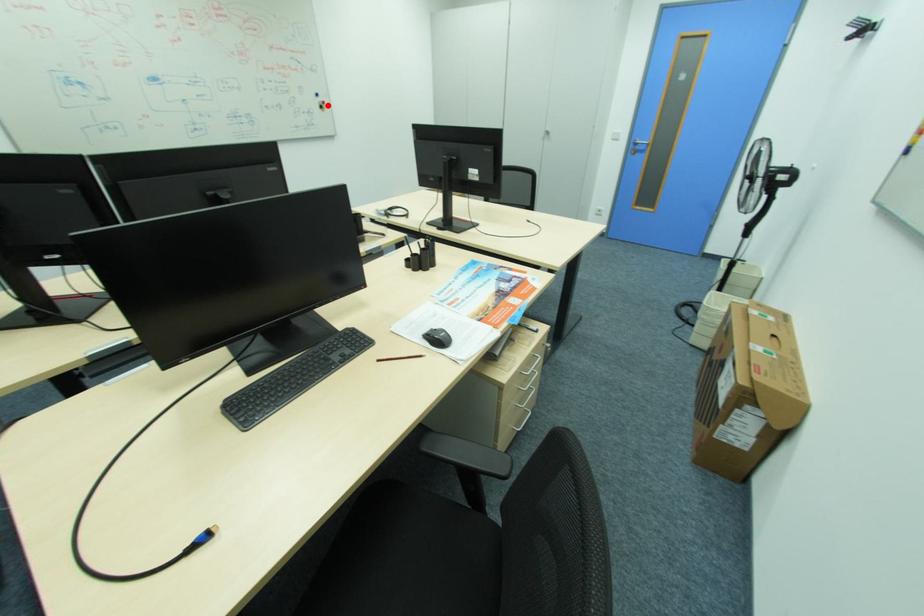
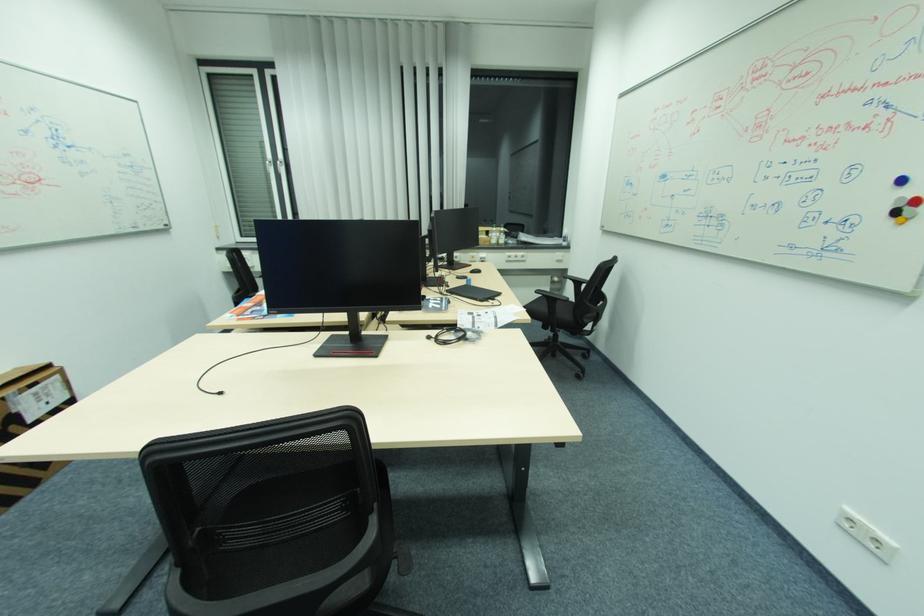
Question: I am providing you with two images of the same scene from different viewpoints. Image1 has a red point marked. In image2, the corresponding 3D location appears at what relative position? Reply with the corresponding letter.

Choices:
 (A) Closer
 (B) Farther

Answer: (B)